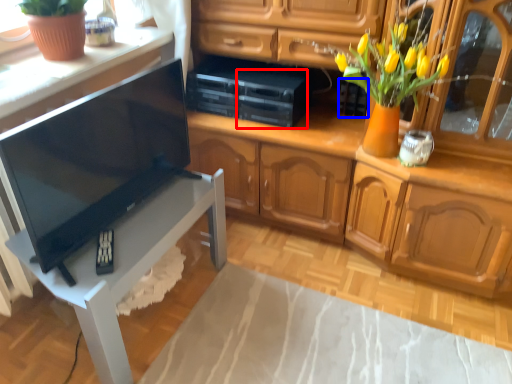
Question: Which object appears farthest to the camera in this image, appliance (highlighted by a red box) or appliance (highlighted by a blue box)?

Choices:
 (A) appliance
 (B) appliance

Answer: (B)